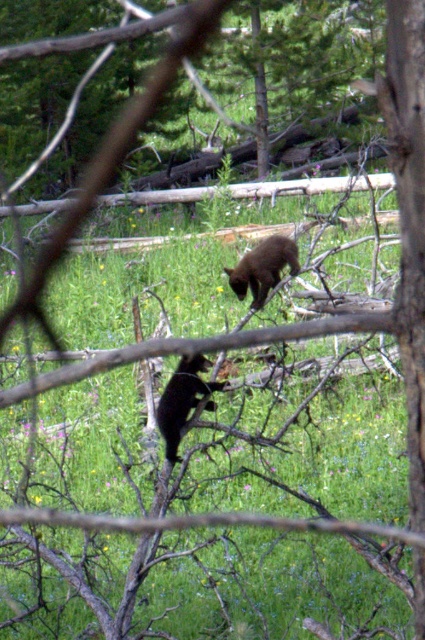
Question: Is black furry bear at center below shiny black bear at center?

Choices:
 (A) yes
 (B) no

Answer: (A)

Question: Which of the following is the closest to the observer?

Choices:
 (A) shiny black bear at center
 (B) black furry bear at center

Answer: (B)

Question: From the image, what is the correct spatial relationship of black furry bear at center in relation to shiny black bear at center?

Choices:
 (A) above
 (B) below

Answer: (B)

Question: Which object appears closest to the camera in this image?

Choices:
 (A) black furry bear at center
 (B) shiny black bear at center

Answer: (A)

Question: Which point is farther to the camera?

Choices:
 (A) shiny black bear at center
 (B) black furry bear at center

Answer: (A)

Question: Can you confirm if black furry bear at center is bigger than shiny black bear at center?

Choices:
 (A) no
 (B) yes

Answer: (B)